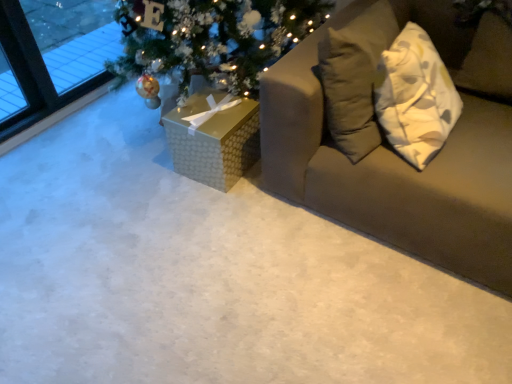
Where is `vacant space in front of gold textured gift box at center`? The image size is (512, 384). vacant space in front of gold textured gift box at center is located at coordinates (217, 207).